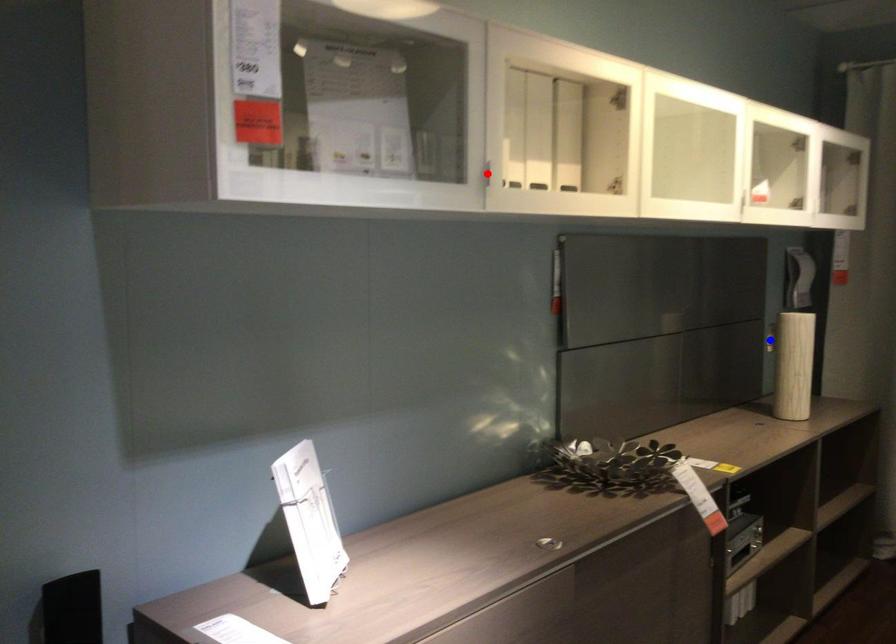
Question: In the image, two points are highlighted. Which point is nearer to the camera? Reply with the corresponding letter.

Choices:
 (A) blue point
 (B) red point

Answer: (B)